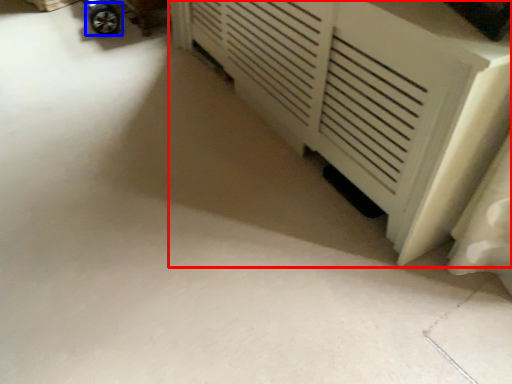
Question: Which point is closer to the camera, furniture (highlighted by a red box) or wheel (highlighted by a blue box)?

Choices:
 (A) furniture
 (B) wheel

Answer: (A)